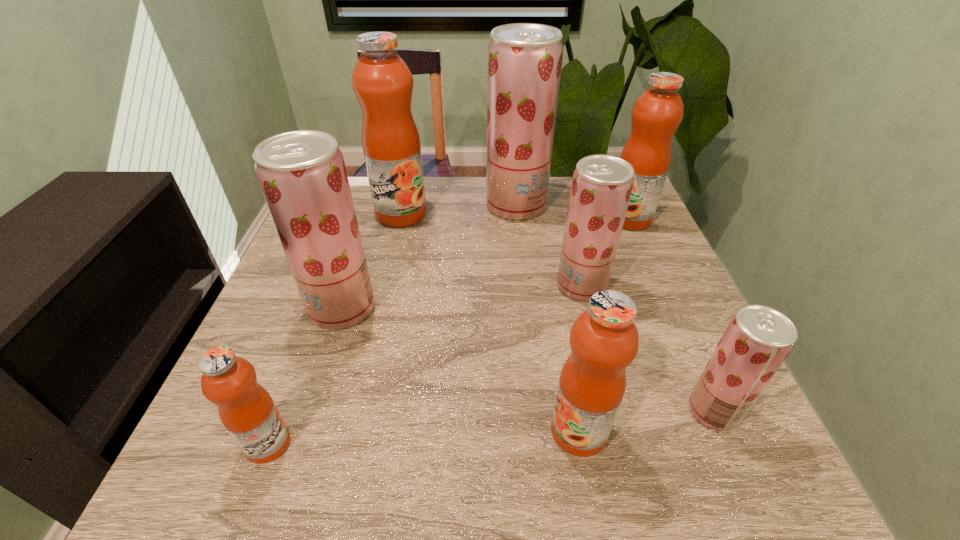
Locate an element on the screen. This screenshot has height=540, width=960. empty location between the farthest strawberry fruit juice and the second orange fruit juice from left to right is located at coordinates (459, 210).

This screenshot has width=960, height=540. In order to click on free space between the biggest strawberry fruit juice and the smallest orange fruit juice in this screenshot , I will do `click(392, 325)`.

Identify the location of free spot between the smallest orange fruit juice and the second biggest orange fruit juice. The image size is (960, 540). (449, 331).

This screenshot has width=960, height=540. In order to click on empty space between the leftmost orange fruit juice and the second smallest orange fruit juice in this screenshot , I will do `click(423, 437)`.

At what (x,y) coordinates should I click in order to perform the action: click on free space between the smallest orange fruit juice and the third biggest strawberry fruit juice. Please return your answer as a coordinate pair (x, y). Image resolution: width=960 pixels, height=540 pixels. Looking at the image, I should click on (425, 364).

Identify which object is the second nearest to the leftmost strawberry fruit juice. Please provide its 2D coordinates. Your answer should be formatted as a tuple, i.e. [(x, y)], where the tuple contains the x and y coordinates of a point satisfying the conditions above.

[(382, 82)]

Choose which object is the seventh nearest neighbor to the second smallest orange fruit juice. Please provide its 2D coordinates. Your answer should be formatted as a tuple, i.e. [(x, y)], where the tuple contains the x and y coordinates of a point satisfying the conditions above.

[(382, 82)]

Locate which fruit juice ranks fourth in proximity to the third biggest strawberry fruit juice. Please provide its 2D coordinates. Your answer should be formatted as a tuple, i.e. [(x, y)], where the tuple contains the x and y coordinates of a point satisfying the conditions above.

[(604, 340)]

In order to click on the closest fruit juice to the third smallest orange fruit juice in this screenshot , I will do `click(524, 59)`.

The image size is (960, 540). I want to click on strawberry fruit juice object that ranks as the third closest to the third smallest strawberry fruit juice, so click(758, 339).